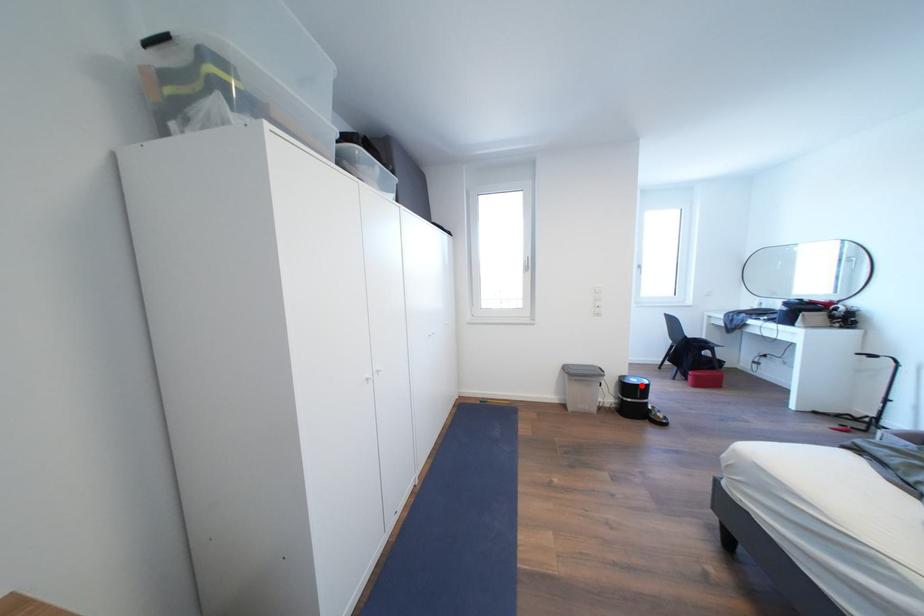
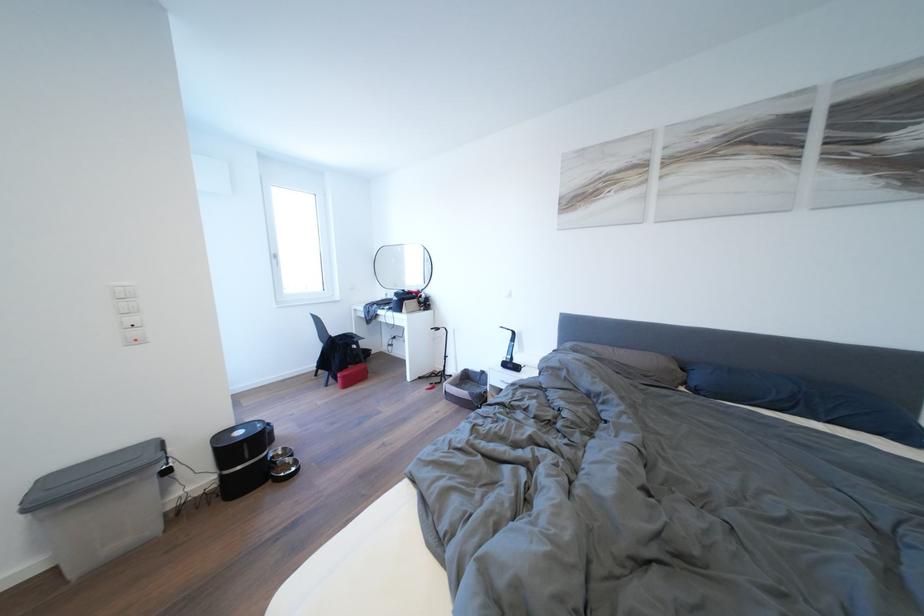
The point at the highlighted location is marked in the first image. Where is the corresponding point in the second image?

(248, 438)